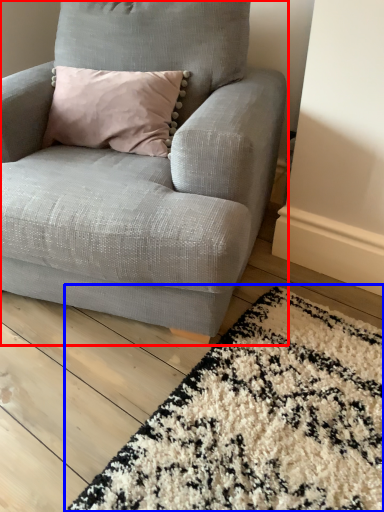
Question: Which of the following is the farthest to the observer, chair (highlighted by a red box) or mat (highlighted by a blue box)?

Choices:
 (A) chair
 (B) mat

Answer: (A)